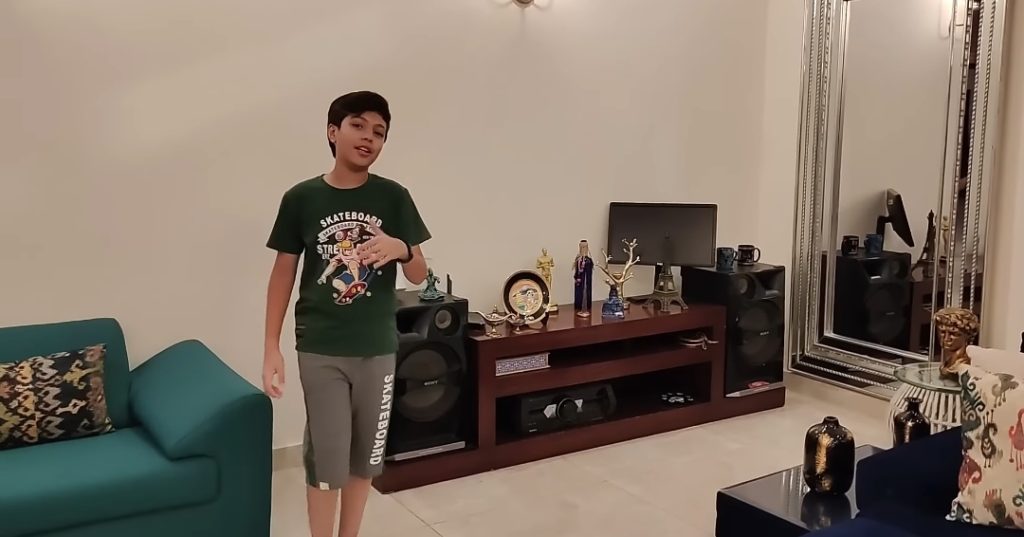
Where is `coffee cup`? The height and width of the screenshot is (537, 1024). coffee cup is located at coordinates (745, 249).